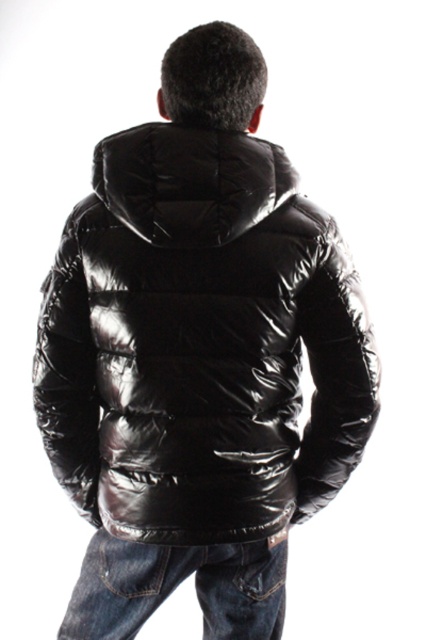
Question: Is glossy black puffer jacket at center positioned in front of denim jeans at lower center?

Choices:
 (A) yes
 (B) no

Answer: (A)

Question: Does glossy black puffer jacket at center have a lesser width compared to denim jeans at lower center?

Choices:
 (A) no
 (B) yes

Answer: (A)

Question: Among these objects, which one is farthest from the camera?

Choices:
 (A) denim jeans at lower center
 (B) glossy black puffer jacket at center

Answer: (A)

Question: Is glossy black puffer jacket at center closer to camera compared to denim jeans at lower center?

Choices:
 (A) yes
 (B) no

Answer: (A)

Question: Which object is farther from the camera taking this photo?

Choices:
 (A) glossy black puffer jacket at center
 (B) denim jeans at lower center

Answer: (B)